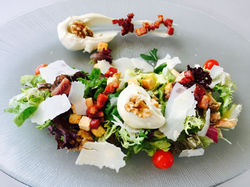
Find the location of a particular element. plate of salad is located at coordinates (114, 112).